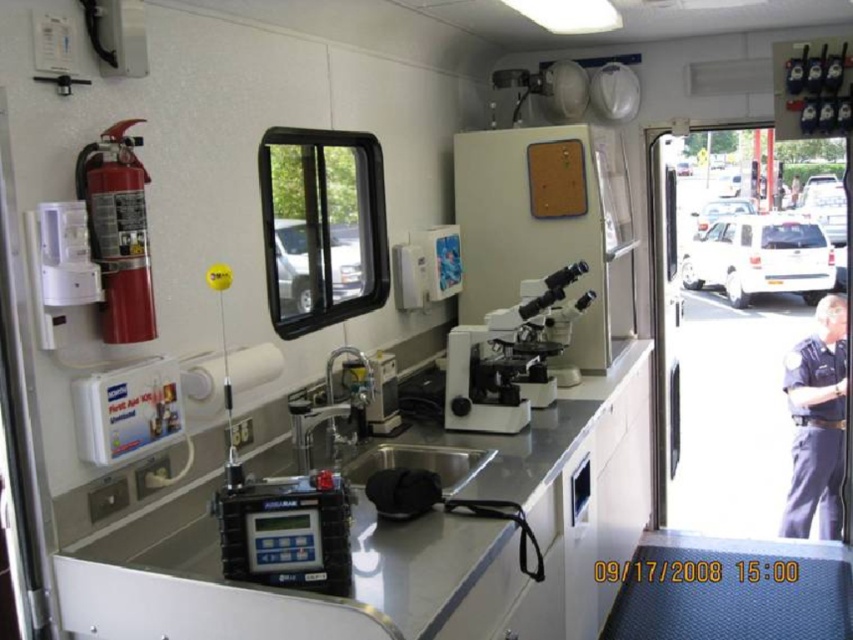
Question: Among these objects, which one is farthest from the camera?

Choices:
 (A) white plastic microscope at center
 (B) dark blue uniform at right

Answer: (B)

Question: Does white plastic microscope at center have a lesser width compared to white matte truck at right?

Choices:
 (A) no
 (B) yes

Answer: (B)

Question: Which point is closer to the camera?

Choices:
 (A) (527, 317)
 (B) (792, 385)

Answer: (A)

Question: Observing the image, what is the correct spatial positioning of white plastic window at upper center in reference to white plastic truck at right?

Choices:
 (A) above
 (B) below

Answer: (B)

Question: Which of these objects is positioned farthest from the white plastic recreational vehicle at center?

Choices:
 (A) white plastic window at upper center
 (B) dark blue uniform at right
 (C) white matte truck at right
 (D) white plastic truck at right

Answer: (A)

Question: Does white matte truck at right have a smaller size compared to white plastic recreational vehicle at center?

Choices:
 (A) no
 (B) yes

Answer: (A)